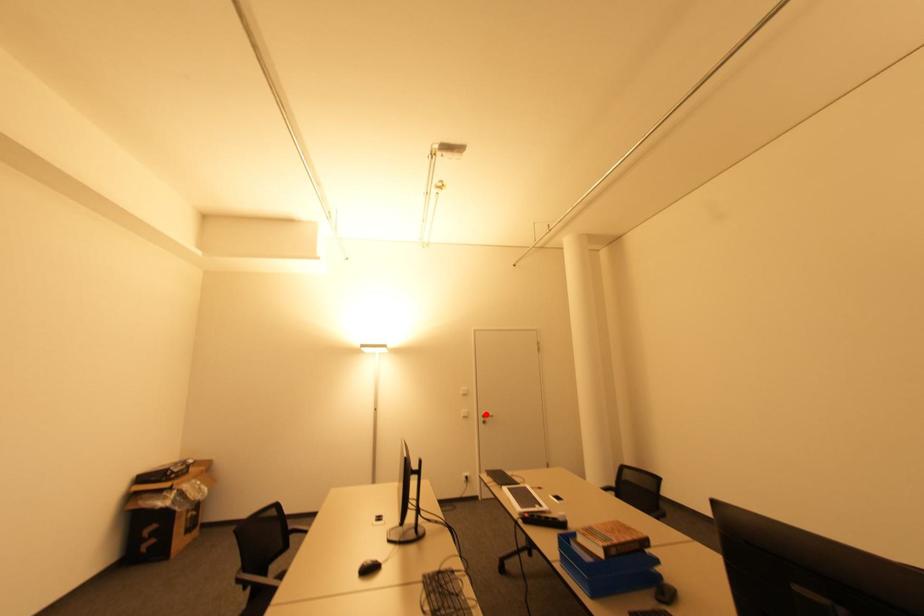
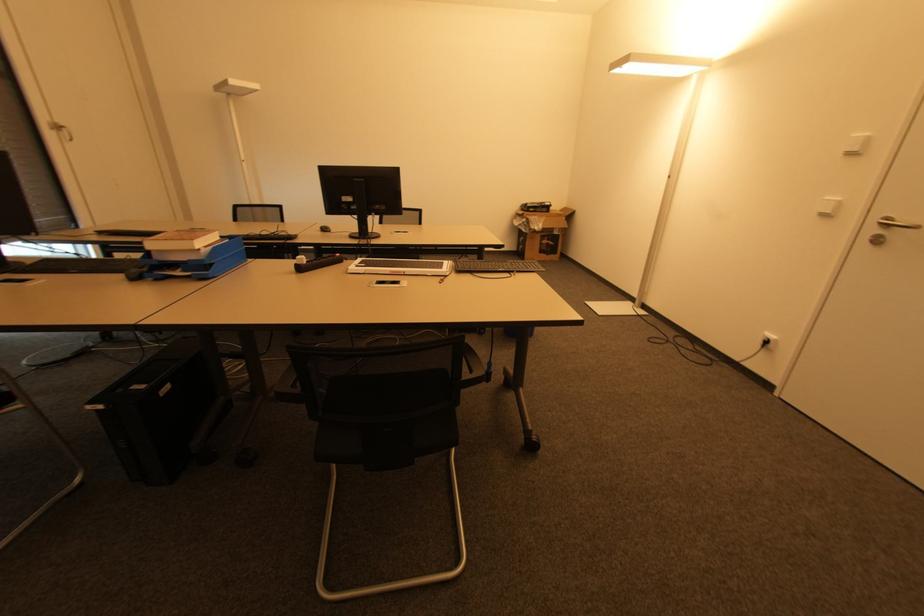
Where in the second image is the point corresponding to the highlighted location from the first image?

(890, 221)